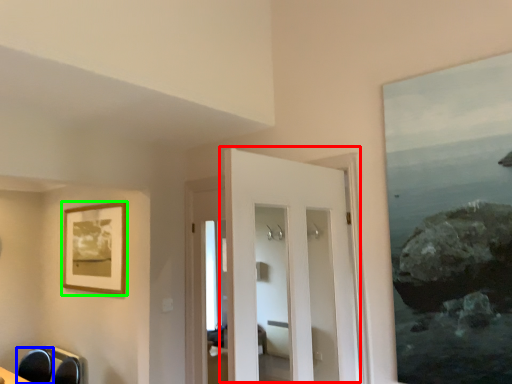
Question: Which is nearer to the door (highlighted by a red box)? swivel chair (highlighted by a blue box) or picture frame (highlighted by a green box).

Choices:
 (A) swivel chair
 (B) picture frame

Answer: (B)